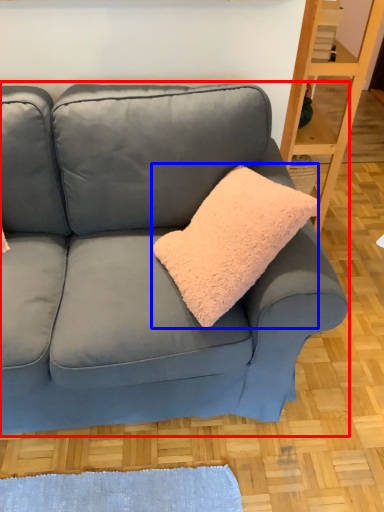
Question: Among these objects, which one is nearest to the camera, studio couch (highlighted by a red box) or throw pillow (highlighted by a blue box)?

Choices:
 (A) studio couch
 (B) throw pillow

Answer: (A)